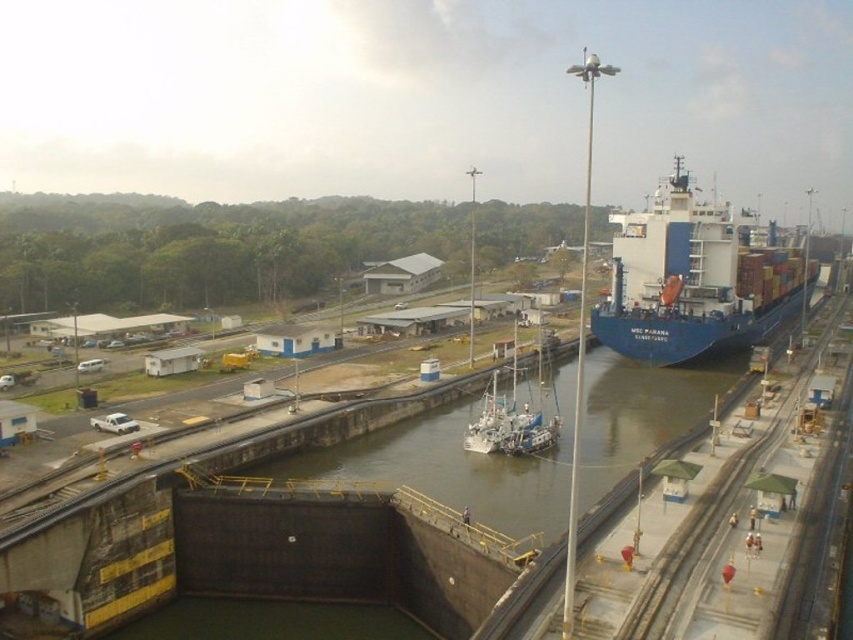
Looking at this image, who is more distant from viewer, (722, 307) or (546, 381)?

Positioned behind is point (722, 307).

Who is positioned more to the left, blue matte container ship at right or white matte boat at center?

From the viewer's perspective, white matte boat at center appears more on the left side.

Between point (643, 305) and point (515, 438), which one is positioned behind?

Point (643, 305)

The width and height of the screenshot is (853, 640). I want to click on blue matte container ship at right, so click(x=692, y=280).